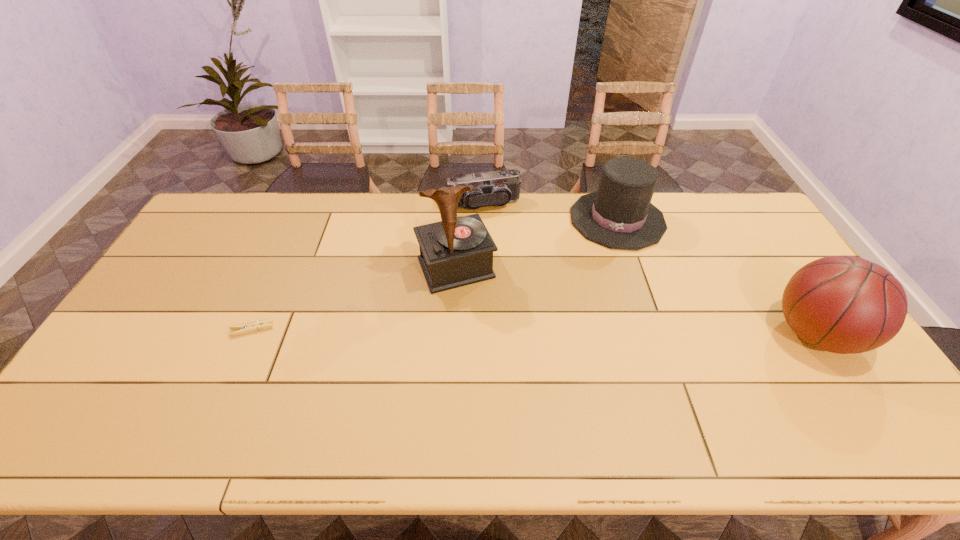
At what (x,y) coordinates should I click in order to perform the action: click on vacant area located 0.060m on the front of the second object from right to left with the decoration. Please return your answer as a coordinate pair (x, y). Looking at the image, I should click on (608, 261).

Where is `free space located on the front of the second object from right to left with the decoration`? The height and width of the screenshot is (540, 960). free space located on the front of the second object from right to left with the decoration is located at coordinates (604, 276).

Locate an element on the screen. The height and width of the screenshot is (540, 960). free space located 0.080m on the front of the second object from right to left with the decoration is located at coordinates (607, 266).

Locate an element on the screen. This screenshot has width=960, height=540. free space located on the front-facing side of the camcorder is located at coordinates (501, 248).

Find the location of `vacant region located on the front-facing side of the camcorder`. vacant region located on the front-facing side of the camcorder is located at coordinates (506, 262).

Identify the location of free space located on the front-facing side of the camcorder. (498, 240).

You are a GUI agent. You are given a task and a screenshot of the screen. Output one action in this format:
    pyautogui.click(x=<x>, y=<y>)
    Task: Click on the free space located at the horn opening of the tallest object
    The image size is (960, 540).
    Given the screenshot: What is the action you would take?
    pyautogui.click(x=516, y=400)

Locate an element on the screen. vacant space situated 0.130m at the horn opening of the tallest object is located at coordinates (483, 326).

In order to click on free space located at the horn opening of the tallest object in this screenshot , I will do `click(499, 364)`.

Identify the location of dress hat that is at the far edge. (619, 215).